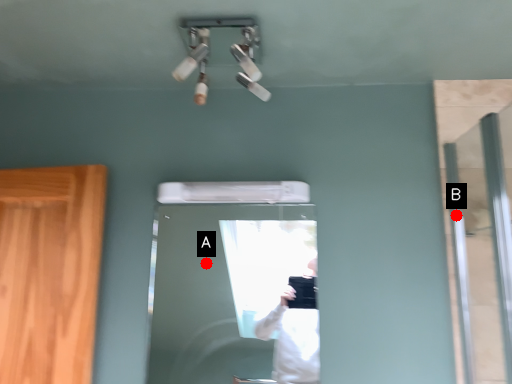
Question: Two points are circled on the image, labeled by A and B beside each circle. Which point is further to the camera?

Choices:
 (A) A is further
 (B) B is further

Answer: (A)